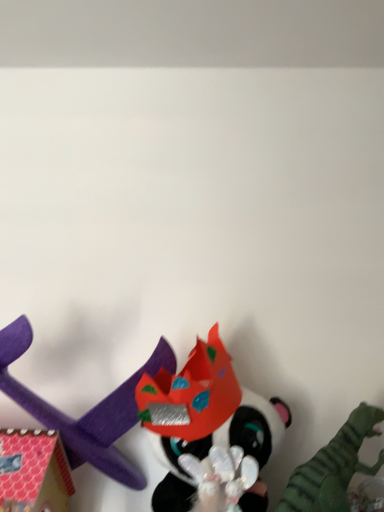
The height and width of the screenshot is (512, 384). Describe the element at coordinates (87, 412) in the screenshot. I see `purple foam airplane at lower left, which appears as the 1th toy when viewed from the left` at that location.

In order to click on shiny red paper crown at center, which ranks as the 2th toy in left-to-right order in this screenshot , I will do `click(204, 417)`.

Between shiny plastic mask at center, the first toy in the right-to-left sequence, and purple foam airplane at lower left, which appears as the 1th toy when viewed from the left, which one appears on the right side from the viewer's perspective?

shiny plastic mask at center, the first toy in the right-to-left sequence.

In the scene shown: Is shiny plastic mask at center, the first toy in the right-to-left sequence, aimed at purple foam airplane at lower left, which appears as the 1th toy when viewed from the left?

No, shiny plastic mask at center, the first toy in the right-to-left sequence, is not turned towards purple foam airplane at lower left, which appears as the 1th toy when viewed from the left.

From the image's perspective, does shiny plastic mask at center, the first toy in the right-to-left sequence, appear lower than purple foam airplane at lower left, the third toy positioned from the right?

Indeed, from the image's perspective, shiny plastic mask at center, the first toy in the right-to-left sequence, is shown beneath purple foam airplane at lower left, the third toy positioned from the right.

Based on their sizes in the image, would you say shiny plastic mask at center, the first toy in the right-to-left sequence, is bigger or smaller than purple foam airplane at lower left, the third toy positioned from the right?

In the image, shiny plastic mask at center, the first toy in the right-to-left sequence, appears to be larger than purple foam airplane at lower left, the third toy positioned from the right.

Locate an element on the screen. This screenshot has width=384, height=512. toy that is on the left side of shiny red paper crown at center, acting as the 2th toy starting from the right is located at coordinates (87, 412).

Which is behind, point (135, 375) or point (152, 394)?

The point (135, 375) is behind.

Considering the sizes of purple foam airplane at lower left, which appears as the 1th toy when viewed from the left, and shiny red paper crown at center, acting as the 2th toy starting from the right, in the image, is purple foam airplane at lower left, which appears as the 1th toy when viewed from the left, taller or shorter than shiny red paper crown at center, acting as the 2th toy starting from the right,?

Considering their sizes, purple foam airplane at lower left, which appears as the 1th toy when viewed from the left, has less height than shiny red paper crown at center, acting as the 2th toy starting from the right.

How distant is purple foam airplane at lower left, the third toy positioned from the right, from shiny red paper crown at center, which ranks as the 2th toy in left-to-right order?

A distance of 4.62 inches exists between purple foam airplane at lower left, the third toy positioned from the right, and shiny red paper crown at center, which ranks as the 2th toy in left-to-right order.

Does shiny plastic mask at center, the 3th toy viewed from the left, have a larger size compared to shiny red paper crown at center, which ranks as the 2th toy in left-to-right order?

Correct, shiny plastic mask at center, the 3th toy viewed from the left, is larger in size than shiny red paper crown at center, which ranks as the 2th toy in left-to-right order.

In terms of height, does shiny plastic mask at center, the 3th toy viewed from the left, look taller or shorter compared to shiny red paper crown at center, which ranks as the 2th toy in left-to-right order?

shiny plastic mask at center, the 3th toy viewed from the left, is shorter than shiny red paper crown at center, which ranks as the 2th toy in left-to-right order.

Find the location of a particular element. the 1st toy counting from the left side of the shiny plastic mask at center, the 3th toy viewed from the left is located at coordinates (204, 417).

From the image's perspective, is shiny plastic mask at center, the first toy in the right-to-left sequence, positioned above or below shiny red paper crown at center, acting as the 2th toy starting from the right?

shiny plastic mask at center, the first toy in the right-to-left sequence, is situated lower than shiny red paper crown at center, acting as the 2th toy starting from the right, in the image.

The width and height of the screenshot is (384, 512). I want to click on the 1st toy positioned below the purple foam airplane at lower left, which appears as the 1th toy when viewed from the left (from the image's perspective), so click(x=204, y=417).

Measure the distance between shiny red paper crown at center, which ranks as the 2th toy in left-to-right order, and purple foam airplane at lower left, which appears as the 1th toy when viewed from the left.

shiny red paper crown at center, which ranks as the 2th toy in left-to-right order, is 4.62 inches from purple foam airplane at lower left, which appears as the 1th toy when viewed from the left.

Based on the photo, considering the relative sizes of shiny red paper crown at center, which ranks as the 2th toy in left-to-right order, and purple foam airplane at lower left, which appears as the 1th toy when viewed from the left, in the image provided, is shiny red paper crown at center, which ranks as the 2th toy in left-to-right order, taller than purple foam airplane at lower left, which appears as the 1th toy when viewed from the left,?

Yes.

Is shiny red paper crown at center, which ranks as the 2th toy in left-to-right order, further to the viewer compared to purple foam airplane at lower left, the third toy positioned from the right?

Yes, it is.

Based on the photo, which is nearer, (117, 460) or (332, 493)?

Clearly, point (117, 460) is more distant from the camera than point (332, 493).

Are purple foam airplane at lower left, which appears as the 1th toy when viewed from the left, and shiny plastic mask at center, the first toy in the right-to-left sequence, located far from each other?

No, purple foam airplane at lower left, which appears as the 1th toy when viewed from the left, is not far from shiny plastic mask at center, the first toy in the right-to-left sequence.

In the scene shown: Considering the relative positions of purple foam airplane at lower left, which appears as the 1th toy when viewed from the left, and shiny plastic mask at center, the first toy in the right-to-left sequence, in the image provided, is purple foam airplane at lower left, which appears as the 1th toy when viewed from the left, to the left of shiny plastic mask at center, the first toy in the right-to-left sequence, from the viewer's perspective?

Indeed, purple foam airplane at lower left, which appears as the 1th toy when viewed from the left, is positioned on the left side of shiny plastic mask at center, the first toy in the right-to-left sequence.

From a real-world perspective, is purple foam airplane at lower left, which appears as the 1th toy when viewed from the left, positioned above or below shiny plastic mask at center, the 3th toy viewed from the left?

Clearly, from a real-world perspective, purple foam airplane at lower left, which appears as the 1th toy when viewed from the left, is above shiny plastic mask at center, the 3th toy viewed from the left.

Which object is positioned more to the right, shiny red paper crown at center, which ranks as the 2th toy in left-to-right order, or shiny plastic mask at center, the 3th toy viewed from the left?

From the viewer's perspective, shiny plastic mask at center, the 3th toy viewed from the left, appears more on the right side.

Is shiny red paper crown at center, which ranks as the 2th toy in left-to-right order, beside shiny plastic mask at center, the 3th toy viewed from the left?

No, shiny red paper crown at center, which ranks as the 2th toy in left-to-right order, is not next to shiny plastic mask at center, the 3th toy viewed from the left.

Considering the sizes of shiny red paper crown at center, which ranks as the 2th toy in left-to-right order, and shiny plastic mask at center, the first toy in the right-to-left sequence, in the image, is shiny red paper crown at center, which ranks as the 2th toy in left-to-right order, taller or shorter than shiny plastic mask at center, the first toy in the right-to-left sequence,?

In the image, shiny red paper crown at center, which ranks as the 2th toy in left-to-right order, appears to be taller than shiny plastic mask at center, the first toy in the right-to-left sequence.

Is shiny red paper crown at center, which ranks as the 2th toy in left-to-right order, spatially inside shiny plastic mask at center, the first toy in the right-to-left sequence, or outside of it?

shiny red paper crown at center, which ranks as the 2th toy in left-to-right order, lies within the bounds of shiny plastic mask at center, the first toy in the right-to-left sequence.

From the image's perspective, which toy is the 2nd one below the purple foam airplane at lower left, which appears as the 1th toy when viewed from the left? Please provide its 2D coordinates.

[(333, 467)]

Locate an element on the screen. the 1st toy counting from the right side of the purple foam airplane at lower left, which appears as the 1th toy when viewed from the left is located at coordinates (204, 417).

Based on the photo, which object lies further to the anchor point purple foam airplane at lower left, the third toy positioned from the right, shiny plastic mask at center, the first toy in the right-to-left sequence, or shiny red paper crown at center, which ranks as the 2th toy in left-to-right order?

shiny plastic mask at center, the first toy in the right-to-left sequence.

Which object lies nearer to the anchor point shiny plastic mask at center, the first toy in the right-to-left sequence, shiny red paper crown at center, acting as the 2th toy starting from the right, or purple foam airplane at lower left, which appears as the 1th toy when viewed from the left?

shiny red paper crown at center, acting as the 2th toy starting from the right, lies closer to shiny plastic mask at center, the first toy in the right-to-left sequence, than the other object.

Which object lies further to the anchor point shiny plastic mask at center, the 3th toy viewed from the left, purple foam airplane at lower left, which appears as the 1th toy when viewed from the left, or shiny red paper crown at center, which ranks as the 2th toy in left-to-right order?

purple foam airplane at lower left, which appears as the 1th toy when viewed from the left, lies further to shiny plastic mask at center, the 3th toy viewed from the left, than the other object.

Looking at the image, which one is located further to shiny red paper crown at center, acting as the 2th toy starting from the right, shiny plastic mask at center, the 3th toy viewed from the left, or purple foam airplane at lower left, which appears as the 1th toy when viewed from the left?

shiny plastic mask at center, the 3th toy viewed from the left.

Considering their positions, is purple foam airplane at lower left, which appears as the 1th toy when viewed from the left, positioned further to shiny red paper crown at center, which ranks as the 2th toy in left-to-right order, than shiny plastic mask at center, the first toy in the right-to-left sequence?

shiny plastic mask at center, the first toy in the right-to-left sequence, is positioned further to the anchor shiny red paper crown at center, which ranks as the 2th toy in left-to-right order.

Considering their positions, is shiny red paper crown at center, which ranks as the 2th toy in left-to-right order, positioned further to purple foam airplane at lower left, the third toy positioned from the right, than shiny plastic mask at center, the 3th toy viewed from the left?

Based on the image, shiny plastic mask at center, the 3th toy viewed from the left, appears to be further to purple foam airplane at lower left, the third toy positioned from the right.

The width and height of the screenshot is (384, 512). What are the coordinates of `toy between purple foam airplane at lower left, the third toy positioned from the right, and shiny plastic mask at center, the 3th toy viewed from the left, in the horizontal direction` in the screenshot? It's located at click(204, 417).